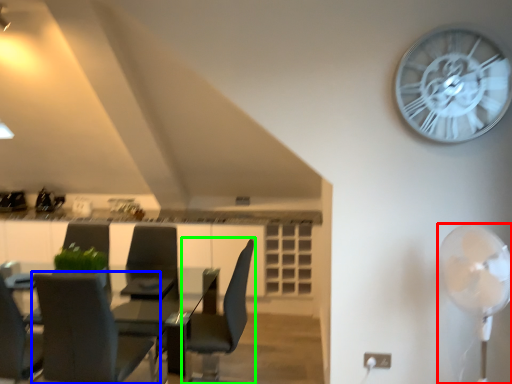
Question: Which object is the farthest from mechanical fan (highlighted by a red box)? Choose among these: chair (highlighted by a blue box) or chair (highlighted by a green box).

Choices:
 (A) chair
 (B) chair

Answer: (A)